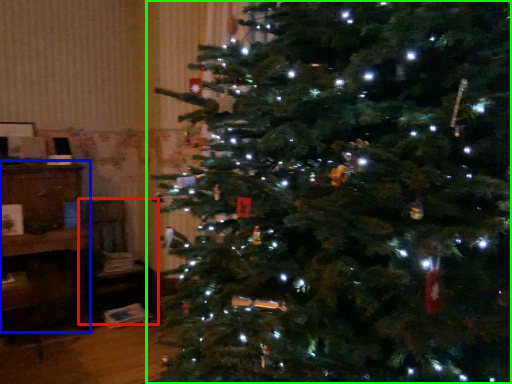
Question: Which is nearer to the chair (highlighted by a red box)? furniture (highlighted by a blue box) or christmas tree (highlighted by a green box).

Choices:
 (A) furniture
 (B) christmas tree

Answer: (A)